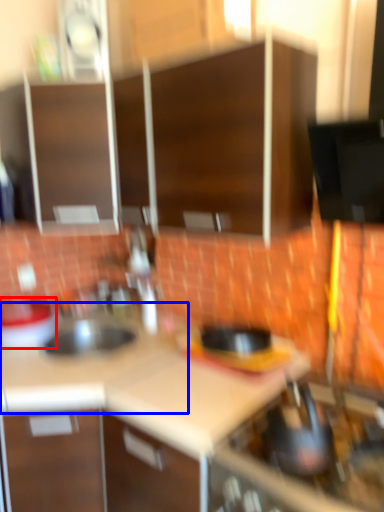
Question: Which point is further to the camera, kitchen appliance (highlighted by a red box) or counter top (highlighted by a blue box)?

Choices:
 (A) kitchen appliance
 (B) counter top

Answer: (A)